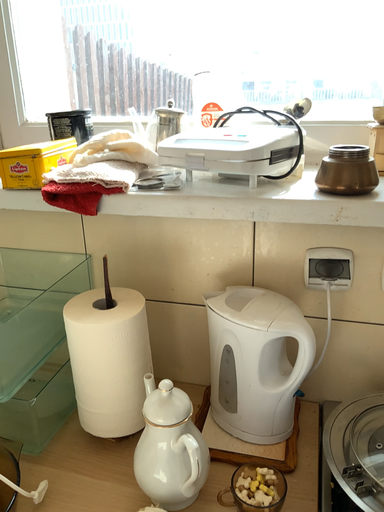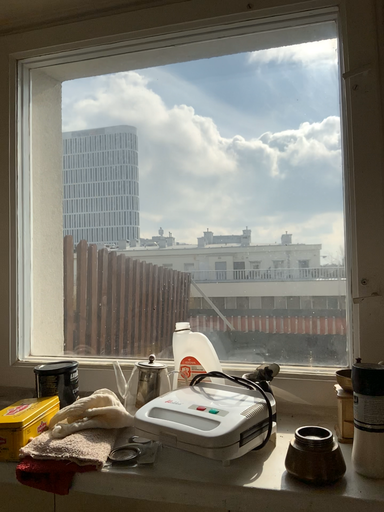
Question: How did the camera likely rotate when shooting the video?

Choices:
 (A) rotated upward
 (B) rotated downward

Answer: (A)